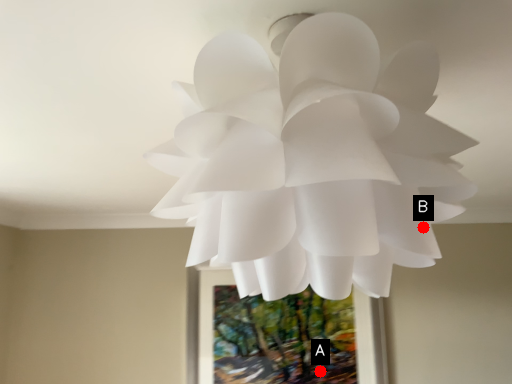
Question: Two points are circled on the image, labeled by A and B beside each circle. Which point is closer to the camera?

Choices:
 (A) A is closer
 (B) B is closer

Answer: (B)